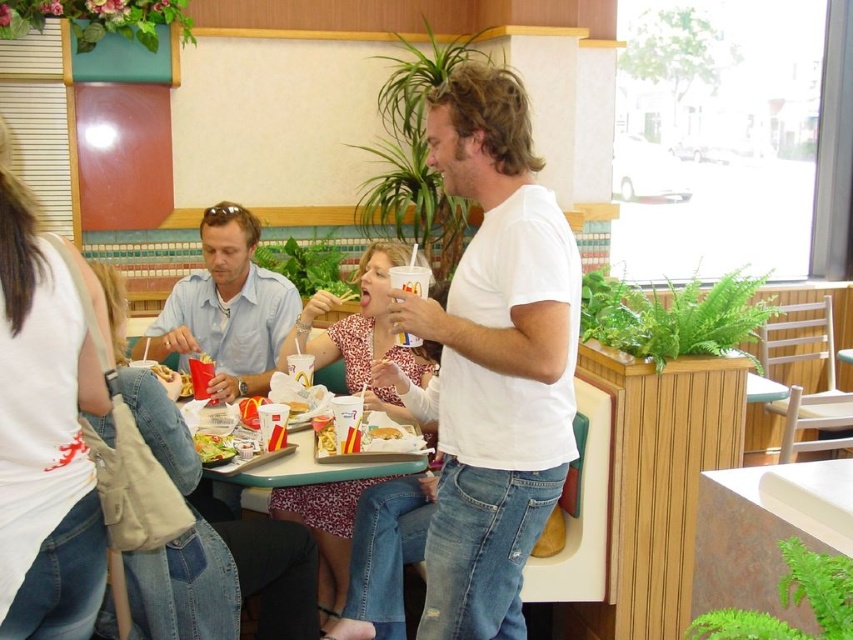
Question: Is the position of golden crispy french fries at center more distant than that of yellow paper cup at center?

Choices:
 (A) yes
 (B) no

Answer: (B)

Question: Is white cotton t-shirt at center in front of golden crispy french fries at center?

Choices:
 (A) yes
 (B) no

Answer: (A)

Question: Among these points, which one is farthest from the camera?

Choices:
 (A) (471, 616)
 (B) (204, 627)
 (C) (305, 410)

Answer: (C)

Question: Based on their relative distances, which object is nearer to the white cotton t-shirt at center?

Choices:
 (A) yellow paper cup at center
 (B) golden crispy french fries at center
 (C) denim jeans at lower left
 (D) green leafy salad at center

Answer: (C)

Question: Which object appears closest to the camera in this image?

Choices:
 (A) golden crispy french fries at center
 (B) plastic tray at center
 (C) green leafy salad at center
 (D) floral dress at center

Answer: (B)

Question: From the image, what is the correct spatial relationship of floral dress at center in relation to yellow paper cup at center?

Choices:
 (A) below
 (B) above

Answer: (B)